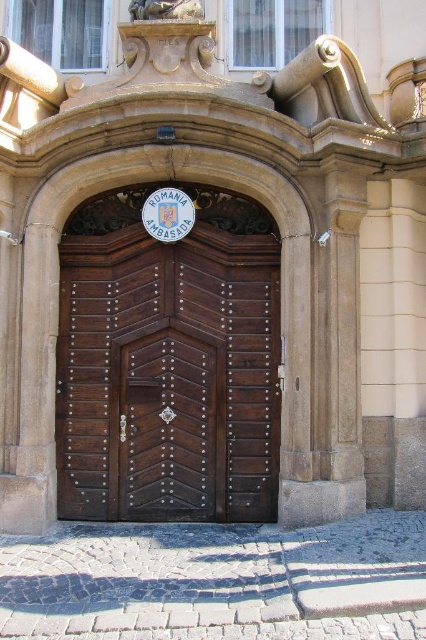
Question: Observing the image, what is the correct spatial positioning of polished wood door at center in reference to dark wood door at center?

Choices:
 (A) above
 (B) below

Answer: (A)

Question: Can you confirm if polished wood door at center is positioned to the right of dark wood door at center?

Choices:
 (A) yes
 (B) no

Answer: (A)

Question: Among these points, which one is farthest from the camera?

Choices:
 (A) [121, 408]
 (B) [195, 506]

Answer: (A)

Question: Is polished wood door at center to the left of dark wood door at center from the viewer's perspective?

Choices:
 (A) no
 (B) yes

Answer: (A)

Question: Which object is closer to the camera taking this photo?

Choices:
 (A) dark wood door at center
 (B) polished wood door at center

Answer: (B)